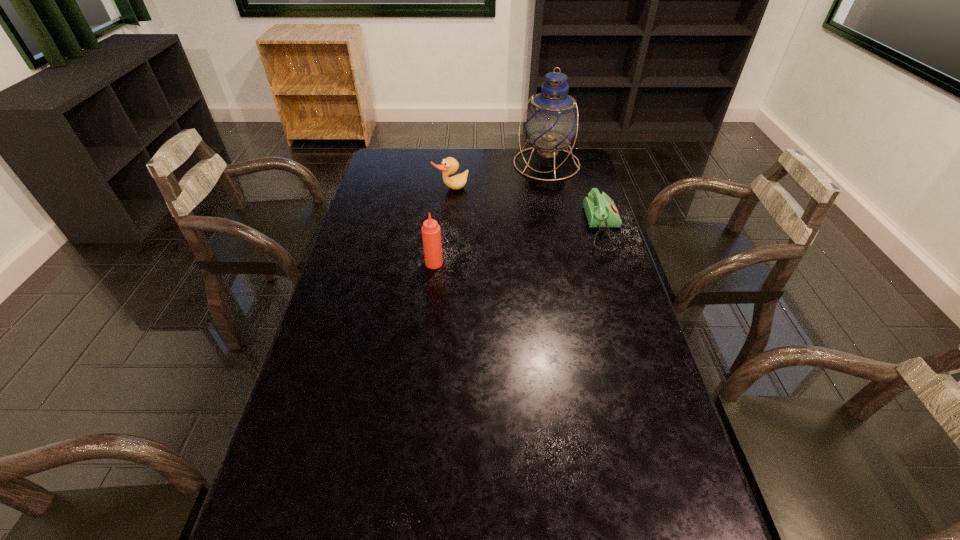
Locate an element on the screen. free space on the desktop that is between the third shortest object and the telephone and is positioned on the front-facing side of the farthest object is located at coordinates (498, 251).

Identify the location of free spot on the desktop that is between the Tabasco sauce and the shortest object and is positioned on the beak of the second farthest object. This screenshot has width=960, height=540. (519, 246).